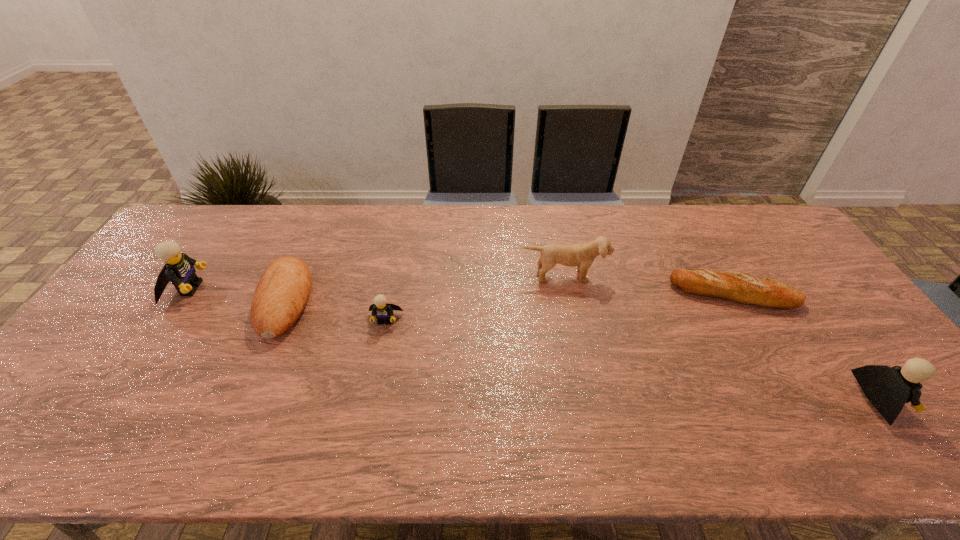
Identify the location of vacant space that is in between the bread and the puppy. The width and height of the screenshot is (960, 540). (424, 288).

You are a GUI agent. You are given a task and a screenshot of the screen. Output one action in this format:
    pyautogui.click(x=<x>, y=<y>)
    Task: Click on the vacant space that's between the nearest Lego and the bread
    This screenshot has width=960, height=540.
    Given the screenshot: What is the action you would take?
    click(583, 350)

Where is `free space between the third object from left to right and the bread`? The height and width of the screenshot is (540, 960). free space between the third object from left to right and the bread is located at coordinates (335, 310).

Identify the location of unoccupied position between the fourth object from right to left and the third object from right to left. Image resolution: width=960 pixels, height=540 pixels. (474, 298).

Where is `unoccupied area between the bread and the farthest Lego`? Image resolution: width=960 pixels, height=540 pixels. unoccupied area between the bread and the farthest Lego is located at coordinates (237, 295).

Select which object is the closest to the nearest object. Please provide its 2D coordinates. Your answer should be formatted as a tuple, i.e. [(x, y)], where the tuple contains the x and y coordinates of a point satisfying the conditions above.

[(739, 287)]

The width and height of the screenshot is (960, 540). Identify the location of object that is the second closest to the rightmost Lego. click(582, 255).

Find the location of a particular element. Lego that stands as the closest to the nearest object is located at coordinates [x=383, y=310].

You are a GUI agent. You are given a task and a screenshot of the screen. Output one action in this format:
    pyautogui.click(x=<x>, y=<y>)
    Task: Click on the Lego that stands as the closest to the rightmost Lego
    
    Given the screenshot: What is the action you would take?
    pyautogui.click(x=383, y=310)

Find the location of a particular element. vacant space that satisfies the following two spatial constraints: 1. on the left side of the fourth object from left to right; 2. on the front-facing side of the farthest Lego is located at coordinates (566, 288).